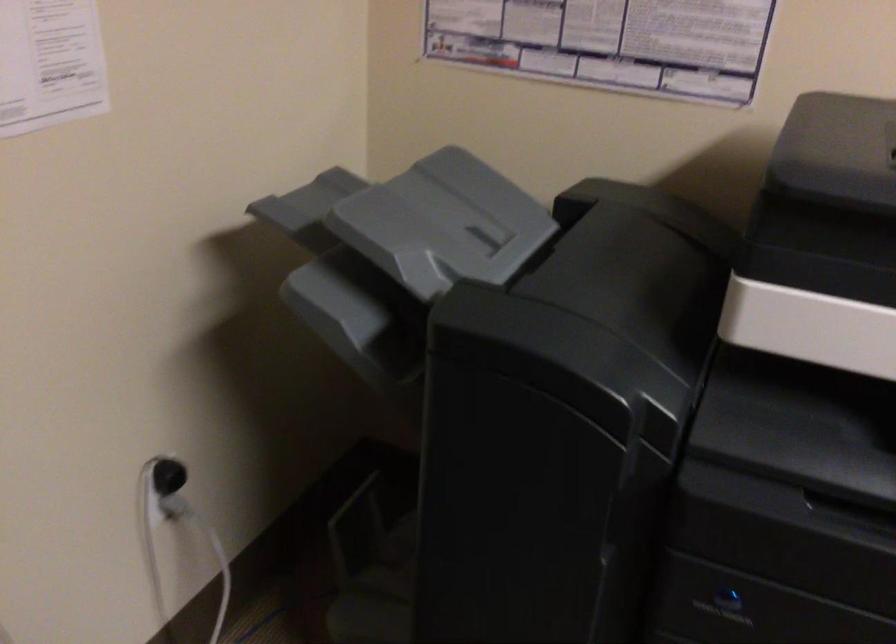
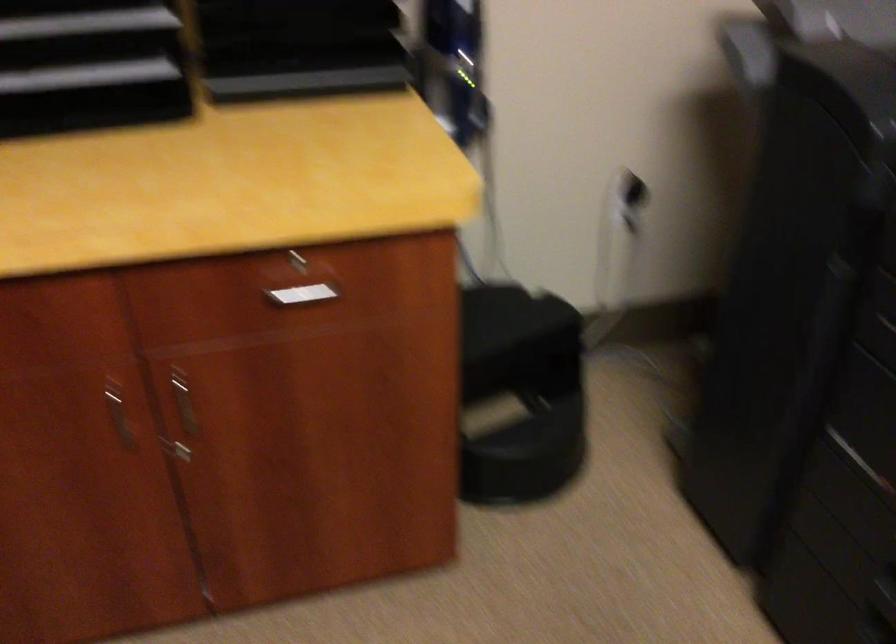
Question: The camera is either moving clockwise (left) or counter-clockwise (right) around the object. The first image is from the beginning of the video and the second image is from the end. Is the camera moving left or right when shooting the video?

Choices:
 (A) Left
 (B) Right

Answer: (B)